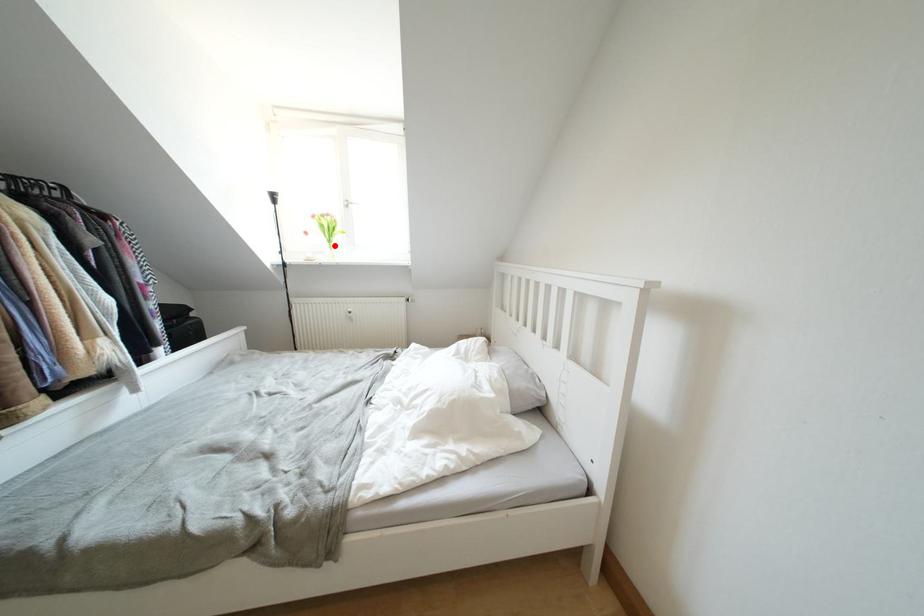
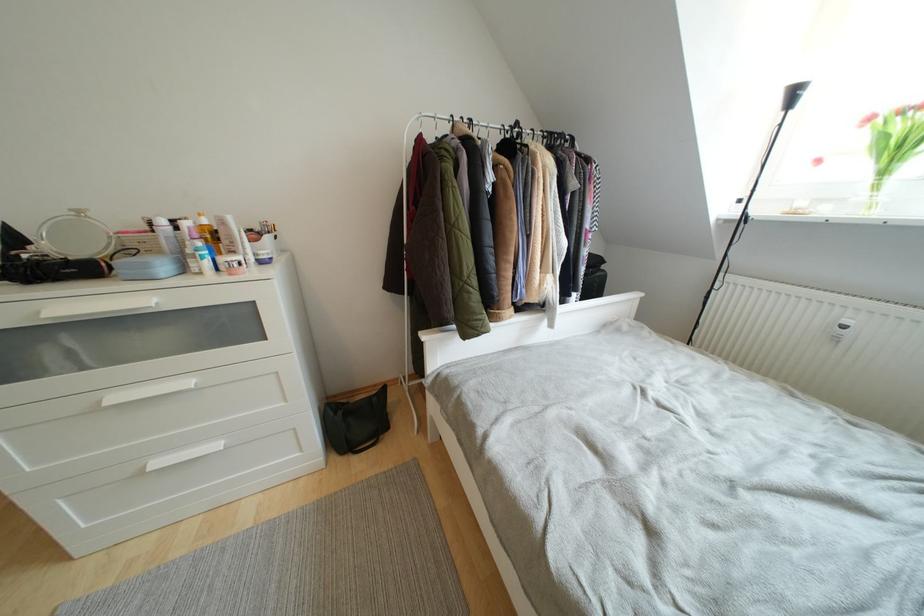
In the second image, find the point that corresponds to the highlighted location in the first image.

(890, 176)